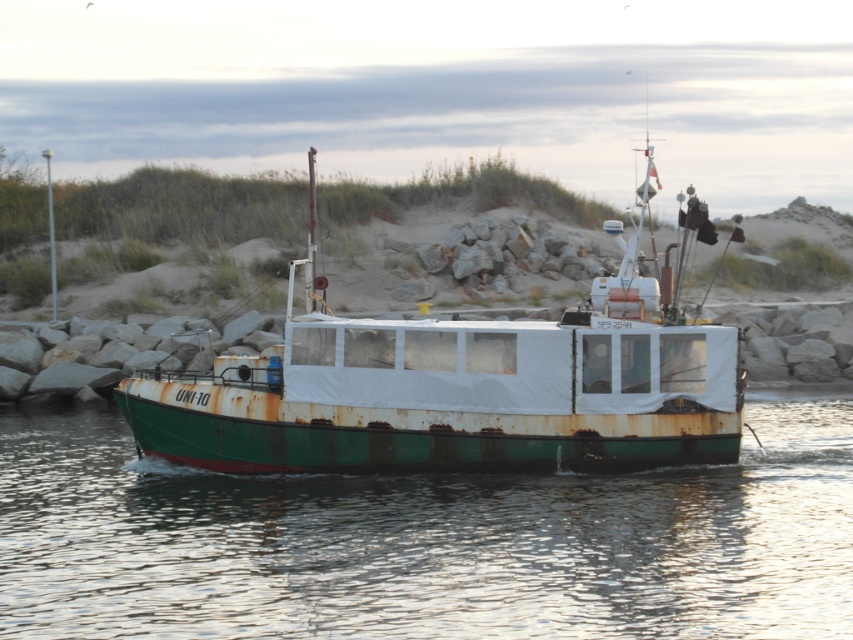
Question: Which object appears farthest from the camera in this image?

Choices:
 (A) rusty metal boat at center
 (B) green rusty water at center

Answer: (A)

Question: Can you confirm if green rusty water at center is positioned to the right of rusty metal boat at center?

Choices:
 (A) no
 (B) yes

Answer: (A)

Question: Is green rusty water at center to the left of rusty metal boat at center from the viewer's perspective?

Choices:
 (A) yes
 (B) no

Answer: (A)

Question: Which of the following is the closest to the observer?

Choices:
 (A) rusty metal boat at center
 (B) green rusty water at center

Answer: (B)

Question: Is green rusty water at center to the right of rusty metal boat at center from the viewer's perspective?

Choices:
 (A) no
 (B) yes

Answer: (A)